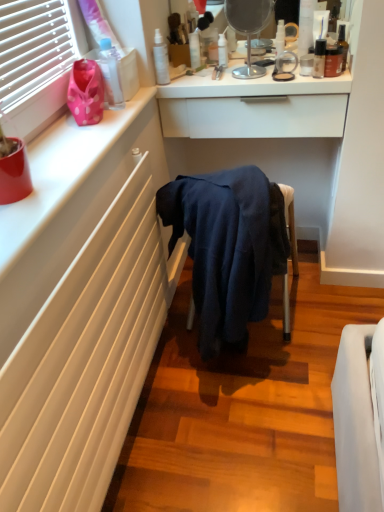
At what (x,y) coordinates should I click in order to perform the action: click on unoccupied area in front of dark blue fabric at center. Please return your answer as a coordinate pair (x, y). Looking at the image, I should click on (272, 393).